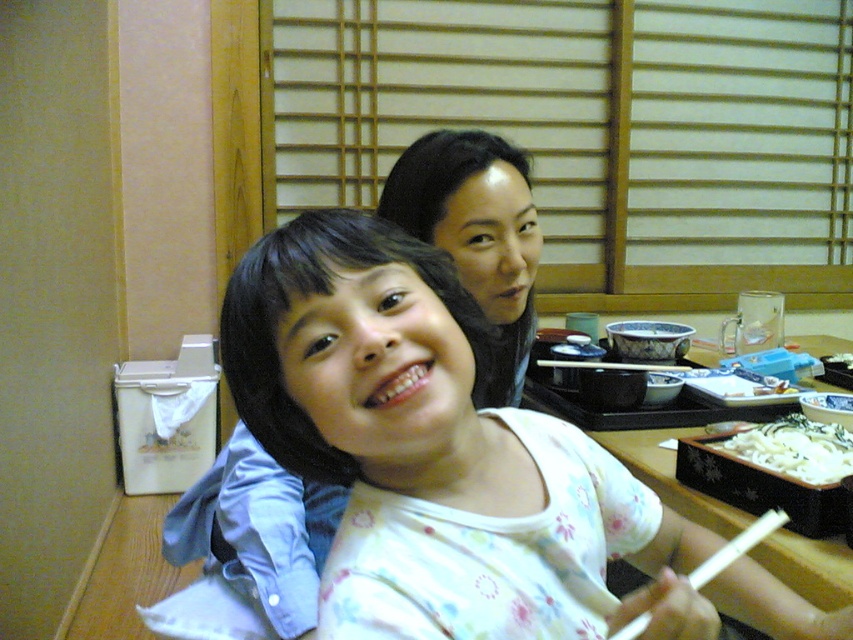
Is point (724, 557) positioned in front of point (642, 365)?

Yes.

Between point (718, 556) and point (691, 368), which one is positioned behind?

Point (691, 368)

Does point (703, 580) come in front of point (601, 364)?

Yes.

In order to click on white plastic chopstick at lower center in this screenshot , I will do `click(735, 547)`.

Is floral cotton shirt at center shorter than wooden table at center?

In fact, floral cotton shirt at center may be taller than wooden table at center.

Who is more distant from viewer, (448, 324) or (834, 577)?

Positioned behind is point (834, 577).

Where is `floral cotton shirt at center`? floral cotton shirt at center is located at coordinates (369, 369).

Is point (833, 605) positioned after point (706, 579)?

Yes, point (833, 605) is behind point (706, 579).

Is point (727, 516) positioned behind point (643, 618)?

Yes, point (727, 516) is behind point (643, 618).

You are a GUI agent. You are given a task and a screenshot of the screen. Output one action in this format:
    pyautogui.click(x=<x>, y=<y>)
    Task: Click on the wooden table at center
    Image resolution: width=853 pixels, height=640 pixels.
    Given the screenshot: What is the action you would take?
    pyautogui.click(x=669, y=476)